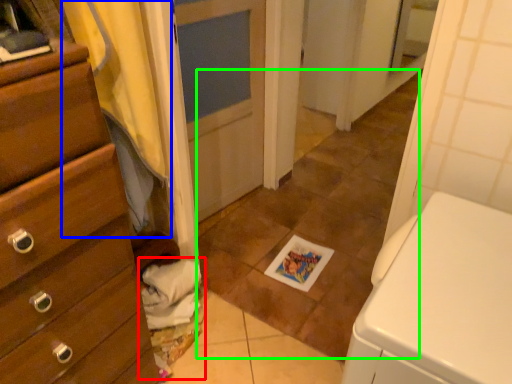
Question: Considering the real-world distances, which object is farthest from laundry (highlighted by a red box)? curtain (highlighted by a blue box) or tile (highlighted by a green box)?

Choices:
 (A) curtain
 (B) tile

Answer: (B)